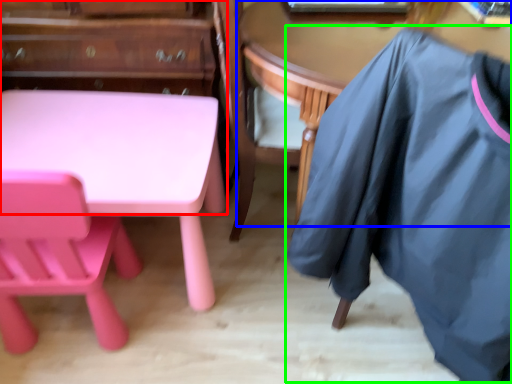
Question: Which is farther away from dresser (highlighted by a red box)? table (highlighted by a blue box) or clothing (highlighted by a green box)?

Choices:
 (A) table
 (B) clothing

Answer: (B)